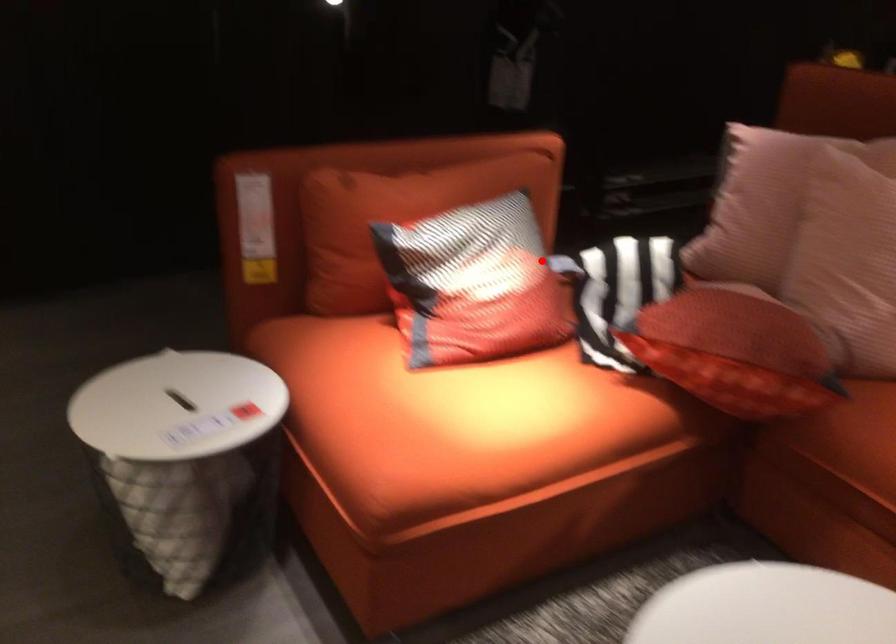
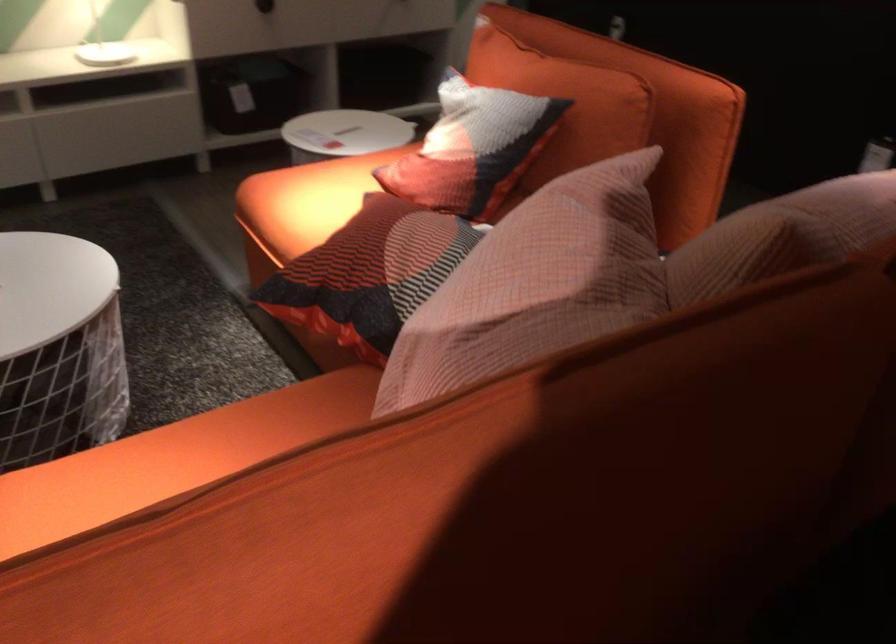
Locate, in the second image, the point that corresponds to the highlighted location in the first image.

(472, 147)